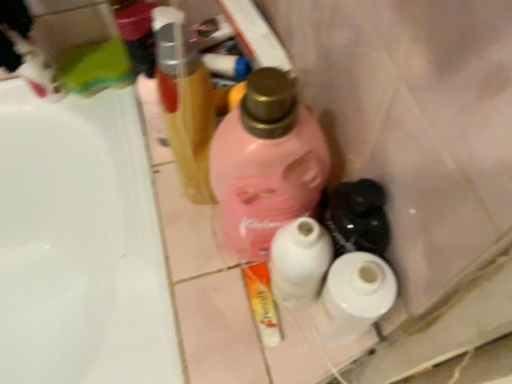
Question: Does pink matte bottle at center, positioned as the 2th bottle in left-to-right order, have a larger size compared to white matte toilet paper at center, acting as the 2th toilet paper starting from the right?

Choices:
 (A) yes
 (B) no

Answer: (A)

Question: Is pink matte bottle at center, positioned as the 2th bottle in left-to-right order, taller than white matte toilet paper at center, the 1th toilet paper when ordered from left to right?

Choices:
 (A) yes
 (B) no

Answer: (A)

Question: Considering the relative sizes of pink matte bottle at center, which is the 1th bottle from right to left, and white matte toilet paper at center, acting as the 2th toilet paper starting from the right, in the image provided, is pink matte bottle at center, which is the 1th bottle from right to left, smaller than white matte toilet paper at center, acting as the 2th toilet paper starting from the right,?

Choices:
 (A) yes
 (B) no

Answer: (B)

Question: From the image's perspective, is pink matte bottle at center, positioned as the 2th bottle in left-to-right order, below white matte toilet paper at center, the 1th toilet paper when ordered from left to right?

Choices:
 (A) yes
 (B) no

Answer: (B)

Question: Could you tell me if pink matte bottle at center, which is the 1th bottle from right to left, is turned towards white matte toilet paper at center, the 1th toilet paper when ordered from left to right?

Choices:
 (A) yes
 (B) no

Answer: (B)

Question: Is pink matte bottle at center, positioned as the 2th bottle in left-to-right order, outside white matte toilet paper at center, the 1th toilet paper when ordered from left to right?

Choices:
 (A) no
 (B) yes

Answer: (B)

Question: Are white matte toilet paper at center, the 1th toilet paper when ordered from left to right, and white glossy tube at center beside each other?

Choices:
 (A) yes
 (B) no

Answer: (A)

Question: Is the depth of white matte toilet paper at center, the 1th toilet paper when ordered from left to right, greater than that of white glossy tube at center?

Choices:
 (A) yes
 (B) no

Answer: (B)

Question: Can you confirm if white matte toilet paper at center, acting as the 2th toilet paper starting from the right, is bigger than white glossy tube at center?

Choices:
 (A) yes
 (B) no

Answer: (A)

Question: Is white matte toilet paper at center, acting as the 2th toilet paper starting from the right, taller than white glossy tube at center?

Choices:
 (A) no
 (B) yes

Answer: (B)

Question: From a real-world perspective, is white matte toilet paper at center, acting as the 2th toilet paper starting from the right, positioned under white glossy tube at center based on gravity?

Choices:
 (A) no
 (B) yes

Answer: (A)

Question: Considering the relative sizes of white matte toilet paper at center, acting as the 2th toilet paper starting from the right, and white glossy tube at center in the image provided, is white matte toilet paper at center, acting as the 2th toilet paper starting from the right, wider than white glossy tube at center?

Choices:
 (A) yes
 (B) no

Answer: (A)

Question: Does metallic gold hairbrush at upper center, which appears as the 1th bottle when viewed from the left, lie in front of white glossy tube at center?

Choices:
 (A) no
 (B) yes

Answer: (B)